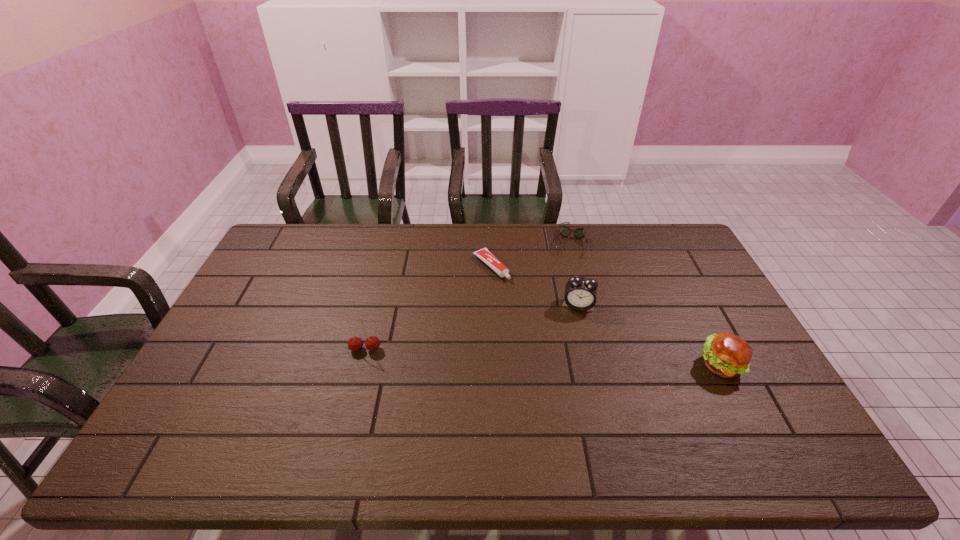
Locate an element on the screen. The image size is (960, 540). vacant point located 0.050m at the nozzle of the shortest object is located at coordinates (511, 288).

Where is `vacant space located at the nozzle of the shortest object`? The height and width of the screenshot is (540, 960). vacant space located at the nozzle of the shortest object is located at coordinates (516, 293).

Where is `blank area located on the front-facing side of the spectacles`? This screenshot has height=540, width=960. blank area located on the front-facing side of the spectacles is located at coordinates (566, 289).

Find the location of `free space located on the front-facing side of the spectacles`. free space located on the front-facing side of the spectacles is located at coordinates (563, 333).

This screenshot has height=540, width=960. In order to click on vacant space located 0.380m on the front-facing side of the spectacles in this screenshot , I will do `click(562, 338)`.

I want to click on vacant area located 0.230m on the front side of the alarm clock, so click(576, 375).

Where is `free point located on the front side of the alarm clock`? This screenshot has height=540, width=960. free point located on the front side of the alarm clock is located at coordinates (576, 372).

Locate an element on the screen. blank area located 0.060m on the front side of the alarm clock is located at coordinates (577, 328).

Where is `toothpaste situated at the far edge`? The height and width of the screenshot is (540, 960). toothpaste situated at the far edge is located at coordinates (485, 255).

Find the location of a particular element. The height and width of the screenshot is (540, 960). spectacles that is at the far edge is located at coordinates (564, 231).